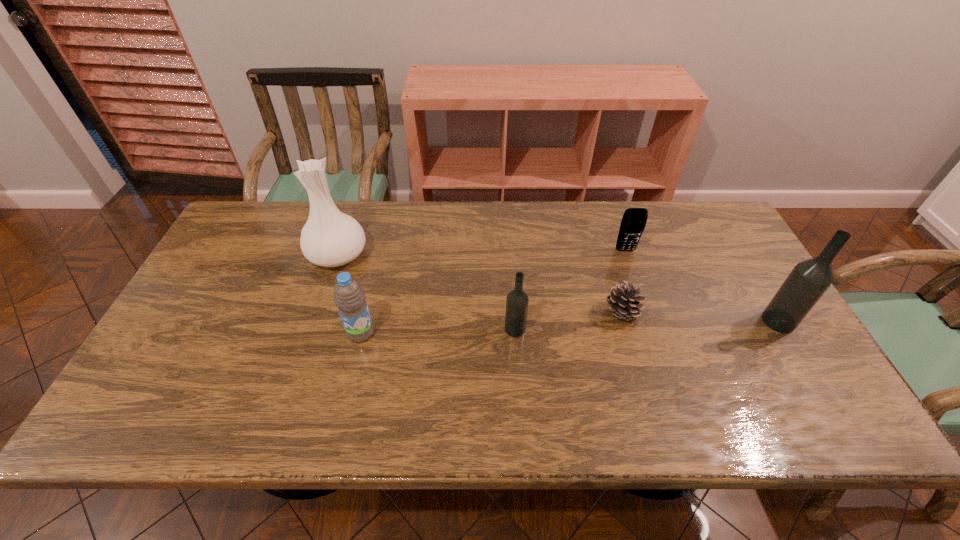
You are a GUI agent. You are given a task and a screenshot of the screen. Output one action in this format:
    pyautogui.click(x=<x>, y=<y>)
    Task: Click on the vacant spot to place a vodka on the left
    This screenshot has width=960, height=540.
    Given the screenshot: What is the action you would take?
    pyautogui.click(x=244, y=337)